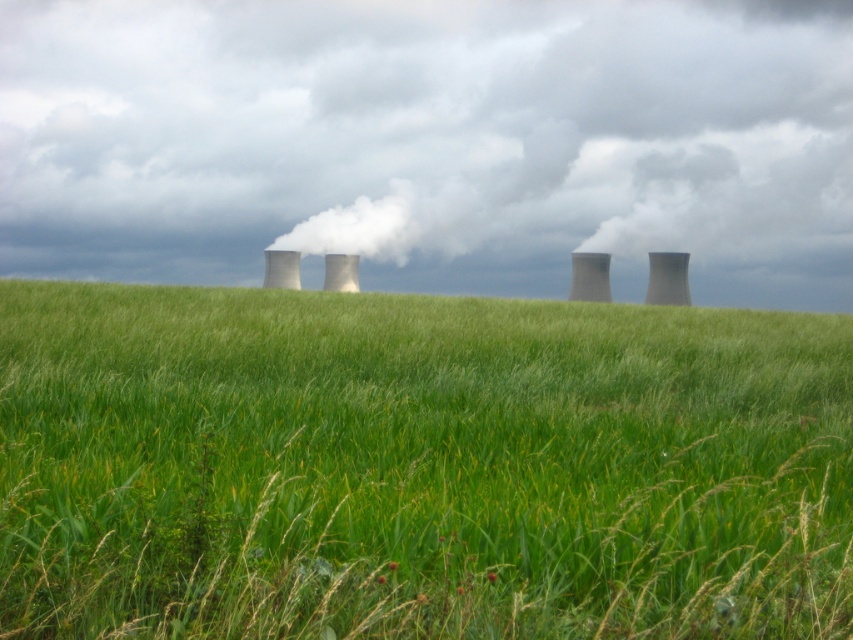
Is green grassy field at center above white smoke at upper center?

Incorrect, green grassy field at center is not positioned above white smoke at upper center.

Can you confirm if green grassy field at center is smaller than white smoke at upper center?

Correct, green grassy field at center occupies less space than white smoke at upper center.

The image size is (853, 640). What are the coordinates of `green grassy field at center` in the screenshot? It's located at (x=418, y=467).

You are a GUI agent. You are given a task and a screenshot of the screen. Output one action in this format:
    pyautogui.click(x=<x>, y=<y>)
    Task: Click on the green grassy field at center
    This screenshot has height=640, width=853.
    Given the screenshot: What is the action you would take?
    pyautogui.click(x=418, y=467)